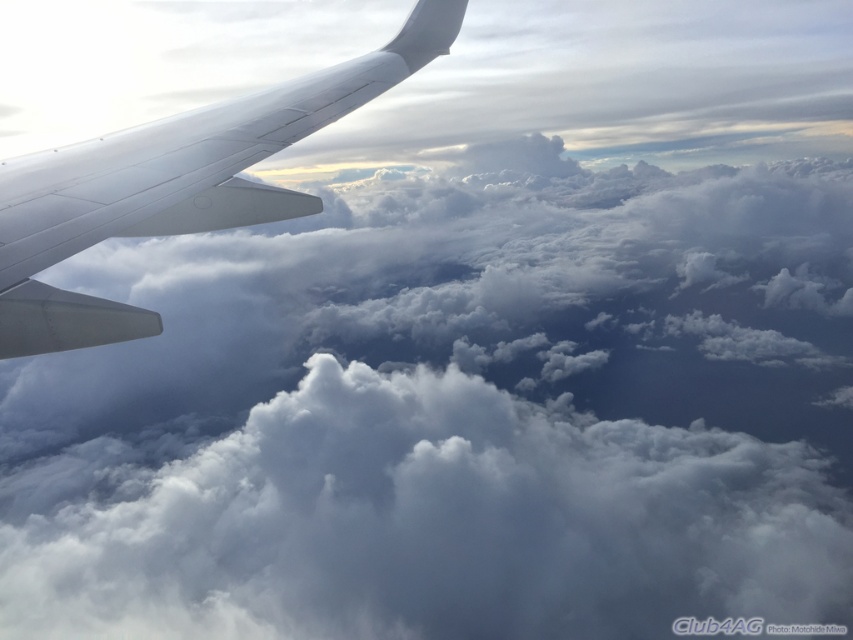
Question: Does white fluffy cloud at center have a greater width compared to white matte airplane wing at upper left?

Choices:
 (A) yes
 (B) no

Answer: (A)

Question: Can you confirm if white fluffy cloud at center is smaller than white matte airplane wing at upper left?

Choices:
 (A) yes
 (B) no

Answer: (B)

Question: Where is white fluffy cloud at center located in relation to white matte airplane wing at upper left in the image?

Choices:
 (A) below
 (B) above

Answer: (A)

Question: Among these points, which one is nearest to the camera?

Choices:
 (A) (80, 205)
 (B) (515, 548)

Answer: (A)